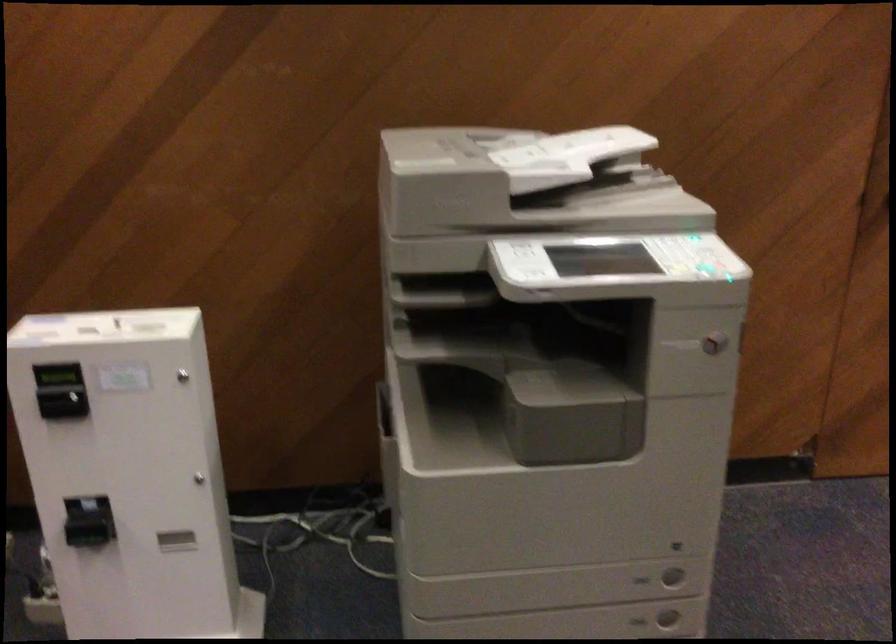
What do you see at coordinates (600, 143) in the screenshot? I see `the scanner lid` at bounding box center [600, 143].